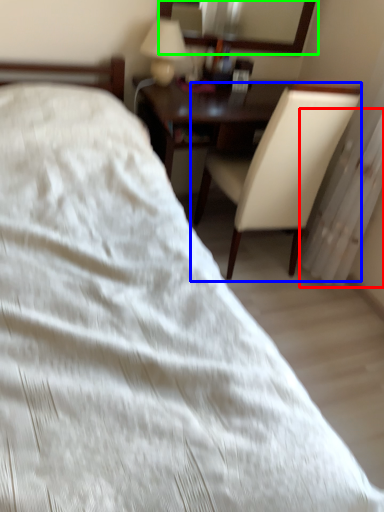
Question: Considering the real-world distances, which object is closest to radiator (highlighted by a red box)? chair (highlighted by a blue box) or mirror (highlighted by a green box).

Choices:
 (A) chair
 (B) mirror

Answer: (A)